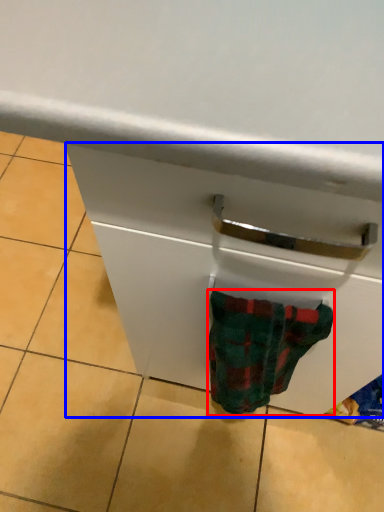
Question: Among these objects, which one is farthest to the camera, sock (highlighted by a red box) or drawer (highlighted by a blue box)?

Choices:
 (A) sock
 (B) drawer

Answer: (B)